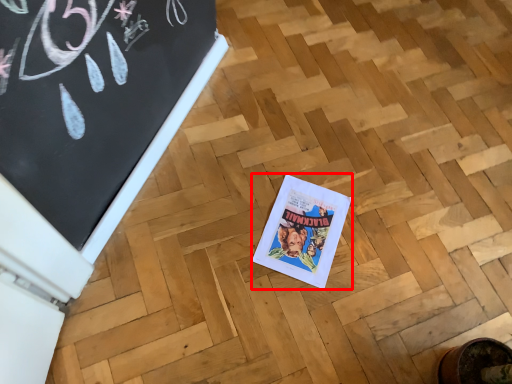
Question: From the image's perspective, where is comic book (annotated by the red box) located in relation to bulletin board in the image?

Choices:
 (A) above
 (B) below

Answer: (B)